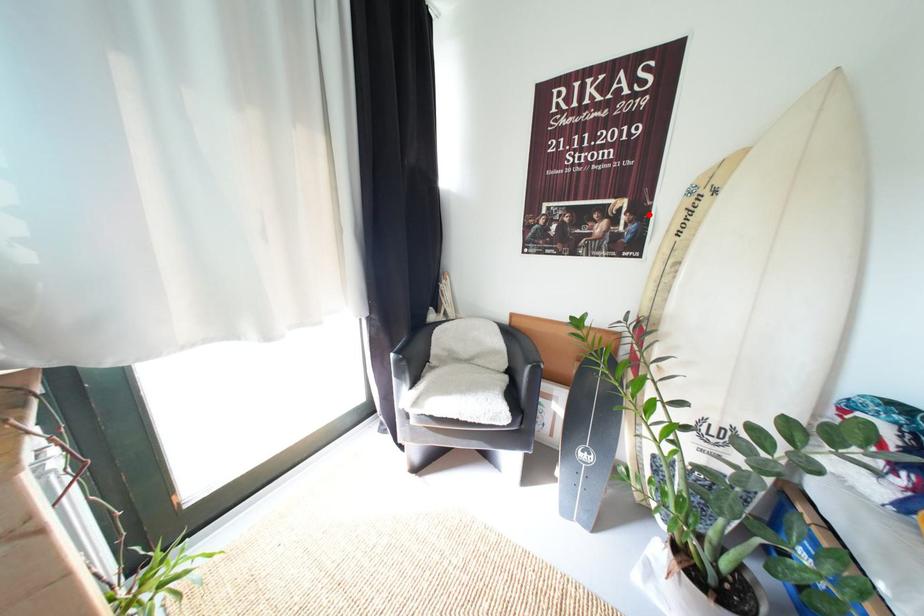
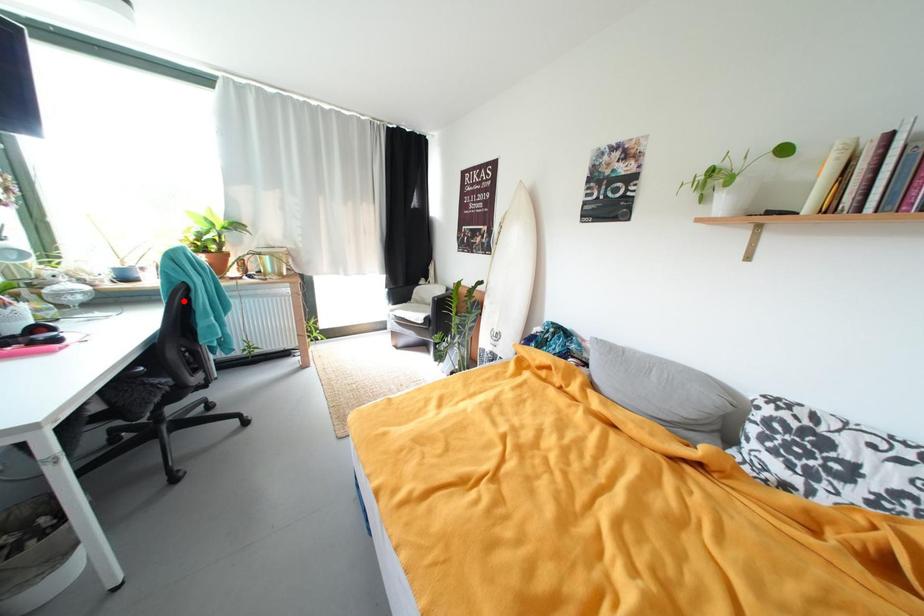
I am providing you with two images of the same scene from different viewpoints. A red point is marked on the first image and another point is marked on the second image. Is the red point in image1 aligned with the point shown in image2?

No